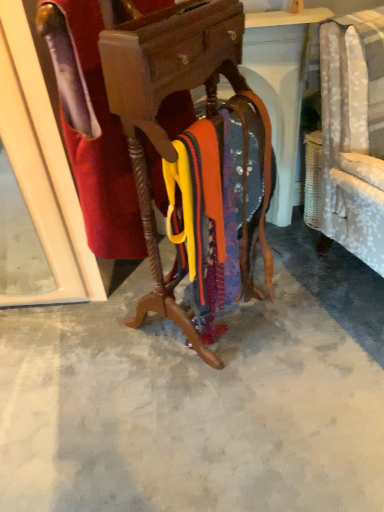
Question: Is wooden coat rack at center placed right next to velvet red robe at center?

Choices:
 (A) yes
 (B) no

Answer: (B)

Question: Does wooden coat rack at center have a smaller size compared to velvet red robe at center?

Choices:
 (A) no
 (B) yes

Answer: (A)

Question: Considering the relative sizes of wooden coat rack at center and velvet red robe at center in the image provided, is wooden coat rack at center thinner than velvet red robe at center?

Choices:
 (A) no
 (B) yes

Answer: (A)

Question: Considering the relative sizes of wooden coat rack at center and velvet red robe at center in the image provided, is wooden coat rack at center wider than velvet red robe at center?

Choices:
 (A) yes
 (B) no

Answer: (A)

Question: Is wooden coat rack at center aimed at velvet red robe at center?

Choices:
 (A) yes
 (B) no

Answer: (A)

Question: From the image's perspective, is smooth concrete floor at center located above or below velvet red robe at center?

Choices:
 (A) above
 (B) below

Answer: (B)

Question: Visually, is smooth concrete floor at center positioned to the left or to the right of velvet red robe at center?

Choices:
 (A) left
 (B) right

Answer: (B)

Question: Is smooth concrete floor at center spatially inside velvet red robe at center, or outside of it?

Choices:
 (A) outside
 (B) inside

Answer: (A)

Question: Does point (327, 466) appear closer or farther from the camera than point (132, 248)?

Choices:
 (A) closer
 (B) farther

Answer: (A)

Question: Is wooden coat rack at center spatially inside velvet red robe at center, or outside of it?

Choices:
 (A) inside
 (B) outside

Answer: (B)

Question: In the image, is wooden coat rack at center positioned in front of or behind velvet red robe at center?

Choices:
 (A) front
 (B) behind

Answer: (A)

Question: From the image's perspective, relative to velvet red robe at center, is wooden coat rack at center above or below?

Choices:
 (A) above
 (B) below

Answer: (B)

Question: Is point (228, 12) positioned closer to the camera than point (94, 153)?

Choices:
 (A) closer
 (B) farther

Answer: (A)

Question: Looking at their shapes, would you say velvet red robe at center is wider or thinner than wooden coat rack at center?

Choices:
 (A) wide
 (B) thin

Answer: (B)

Question: From the image's perspective, relative to wooden coat rack at center, is velvet red robe at center above or below?

Choices:
 (A) above
 (B) below

Answer: (A)